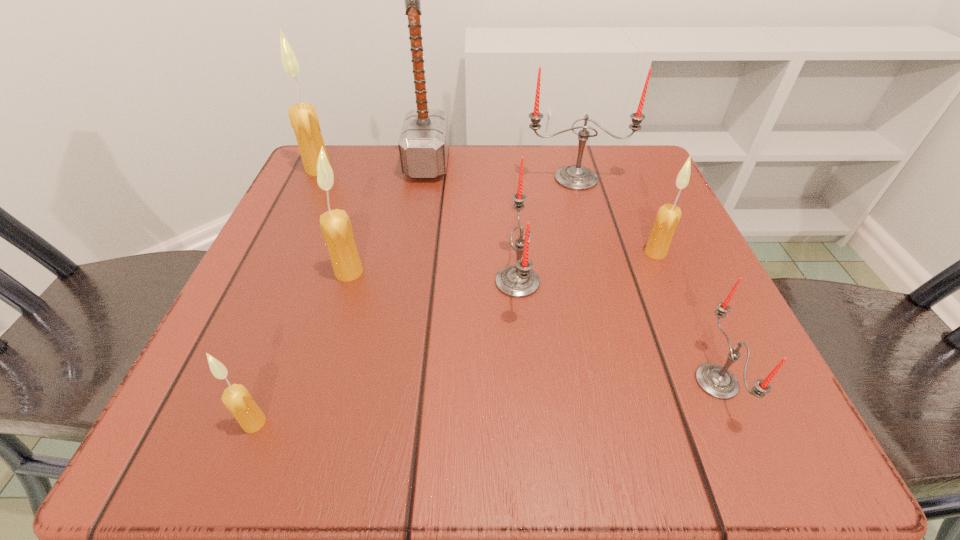
You are a GUI agent. You are given a task and a screenshot of the screen. Output one action in this format:
    pyautogui.click(x=<x>, y=<y>)
    Task: Click on the free space located 0.300m on the left of the third nearest cream candle
    
    Given the screenshot: What is the action you would take?
    pyautogui.click(x=468, y=253)

Identify the location of free space located 0.360m on the right of the smallest cream candle. The width and height of the screenshot is (960, 540). (564, 423).

At what (x,y) coordinates should I click in order to perform the action: click on vacant position located 0.150m on the front-facing side of the smallest red candle. Please return your answer as a coordinate pair (x, y). Image resolution: width=960 pixels, height=540 pixels. Looking at the image, I should click on (581, 381).

Identify the location of free space located on the front-facing side of the smallest red candle. Image resolution: width=960 pixels, height=540 pixels. pyautogui.click(x=604, y=381).

Find the location of `free space located on the front-facing side of the smallest red candle`. free space located on the front-facing side of the smallest red candle is located at coordinates (426, 381).

Find the location of a particular element. hammer located at the far edge is located at coordinates (423, 144).

Image resolution: width=960 pixels, height=540 pixels. What are the coordinates of `object positioned at the far left corner` in the screenshot? It's located at (303, 117).

In order to click on object that is at the near left corner in this screenshot , I will do `click(236, 398)`.

Locate an element on the screen. The image size is (960, 540). object that is at the far right corner is located at coordinates click(574, 177).

Identify the location of object at the near right corner. (715, 380).